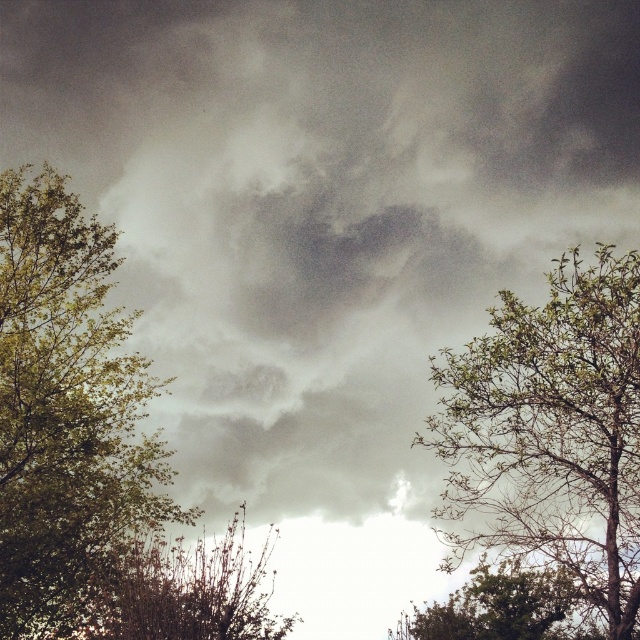
You are an observer standing in the middle of the scene. You notice the green leafy tree at left and the brown textured bush at lower left. Which one appears shorter from your viewpoint?

The green leafy tree at left appears shorter than the brown textured bush at lower left.

You are standing in the scene and want to walk from the brown textured bush at lower left to the green leafy tree at lower right. Which direction should you move to reach the tree without going through the bush?

Since the brown textured bush at lower left is in front of the green leafy tree at lower right, you should move towards the right and behind the bush to reach the tree without going through it.

You are a bird looking for a place to perch. You can choose between the green leafy tree at left and the green leafy tree at right. If you want to fly between them, how far apart are these two trees?

The green leafy tree at left and the green leafy tree at right are 27.23 feet apart from each other.